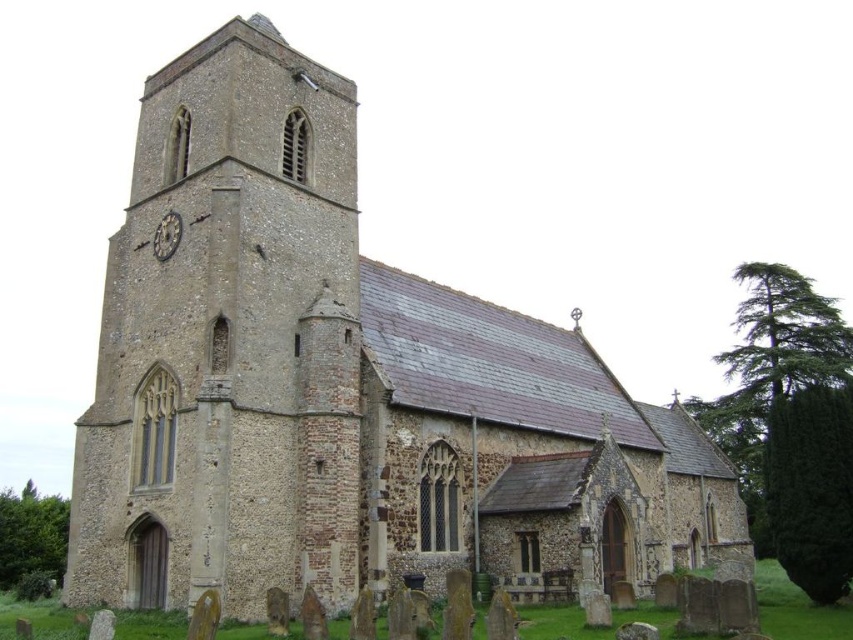
You are an architect designing a new building and want to incorporate elements from this church. You have two options for a central feature. The first is the brown stone tower at left, and the second is the dark gray stone clock at upper left. Which of these two elements would be more suitable if you want a larger, more dominant structure as the focal point?

The brown stone tower at left is bigger than the dark gray stone clock at upper left, so it would be more suitable as a larger, more dominant focal point.

Looking at this image, you are standing in front of the church and want to take a photo of both the brown stone tower at left and the dark gray stone clock at upper left. Which object should you position to the left side of your frame to include both in the photo?

You should position the dark gray stone clock at upper left to the left side of your frame because the brown stone tower at left is on the right side of it, allowing both to be captured together.

You are standing in front of the church and want to take a photo of both the brown stone tower at left and the dark gray stone clock at upper left. Which object should you focus on first to ensure both are fully captured in the frame?

You should focus on the brown stone tower at left first because it is much taller than the dark gray stone clock at upper left, so capturing its full height will ensure the smaller clock is also included.